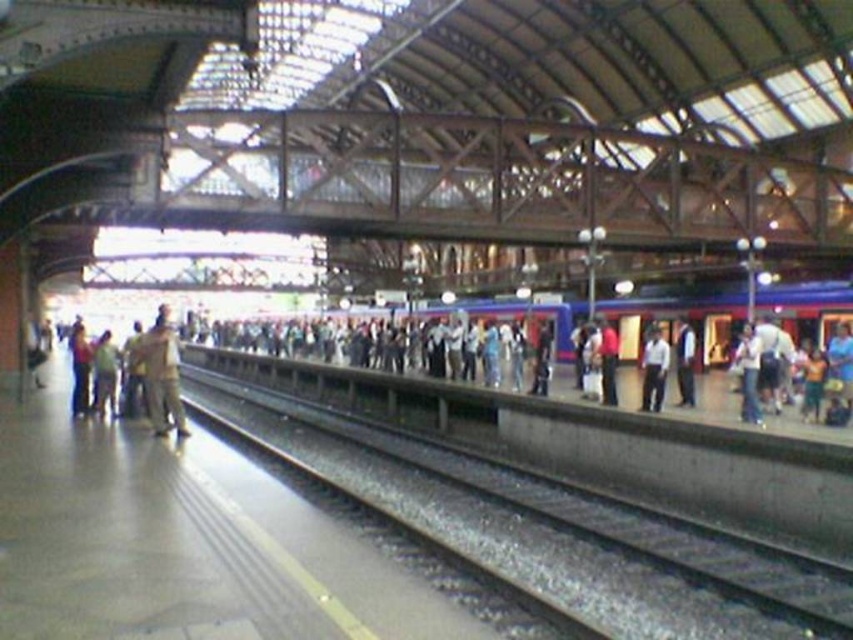
In the scene shown: You are standing on the platform and want to board the blue metallic train at center. To your right, you notice jeans at right. In which direction should you walk to reach the train?

You should walk to the left because the blue metallic train at center is to the left of jeans at right, so moving left from the jeans at right will lead you toward the train.

You are a photographer standing on the platform and want to capture both the black metal train track at center and the camouflage fabric jacket at center in a single frame. Which object appears narrower in your photo?

The black metal train track at center appears narrower in the photo because it has a lesser width compared to the camouflage fabric jacket at center.

You are a photographer standing at the train station platform. You want to take a photo of the black metal train track at center and the camouflage fabric jacket at center. Which object should you zoom in more on to ensure both are in focus?

Since the black metal train track at center is smaller than the camouflage fabric jacket at center, you should zoom in more on the smaller object to ensure both are in focus.